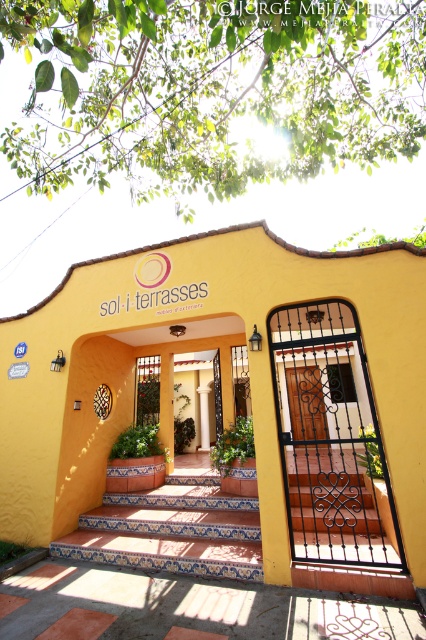
Does blue tile stairs at center come behind wooden door at center?

That is False.

Identify the location of blue tile stairs at center. This screenshot has height=640, width=426. (172, 528).

Is point (166, 554) positioned behind point (304, 372)?

That is False.

Where is `blue tile stairs at center`? This screenshot has height=640, width=426. blue tile stairs at center is located at coordinates (x=172, y=528).